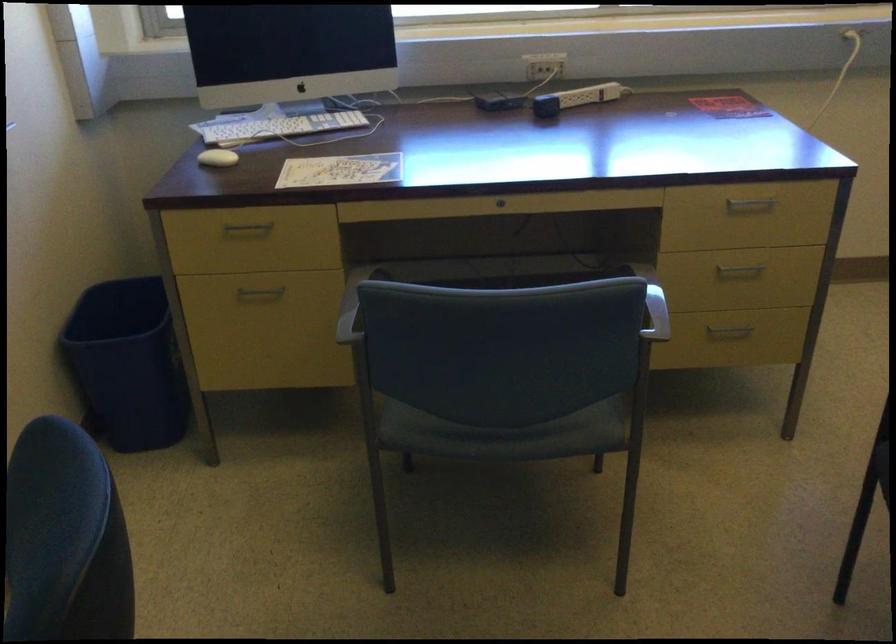
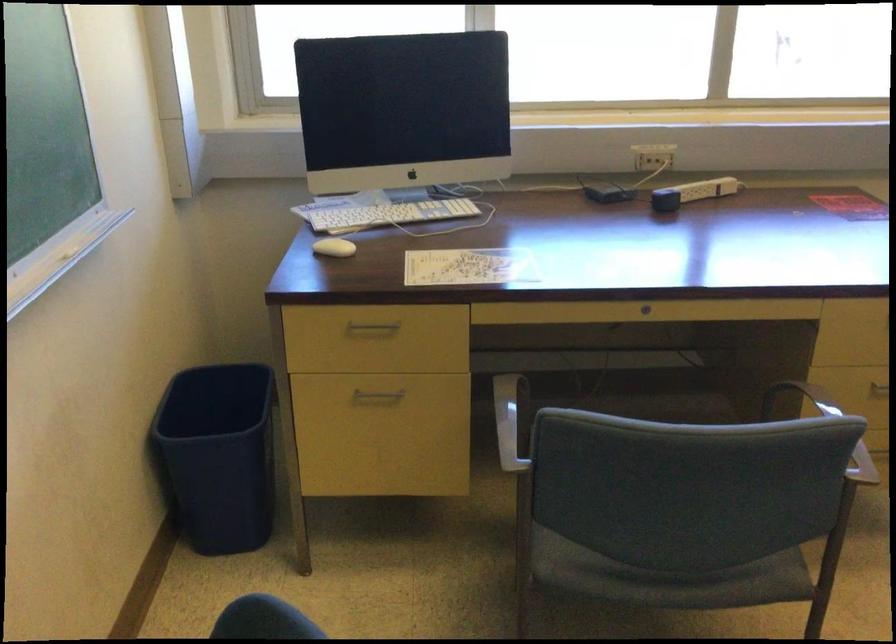
Find the pixel in the second image that matches pixel 250 230 in the first image.

(373, 327)